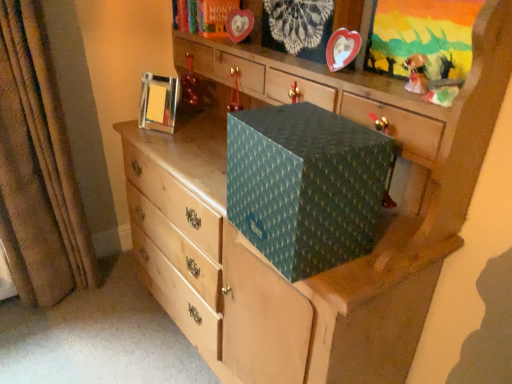
Where is `free location in front of brown textured curtain at left`? This screenshot has width=512, height=384. free location in front of brown textured curtain at left is located at coordinates (47, 342).